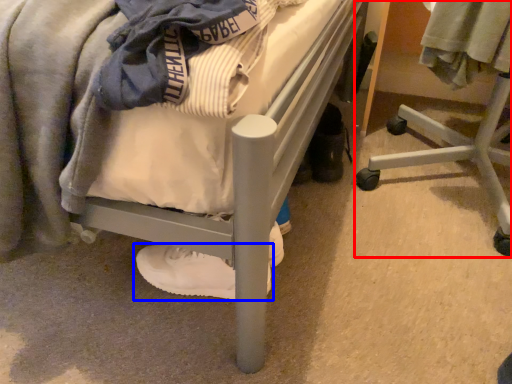
Question: Which object appears closest to the camera in this image, furniture (highlighted by a red box) or footwear (highlighted by a blue box)?

Choices:
 (A) furniture
 (B) footwear

Answer: (A)